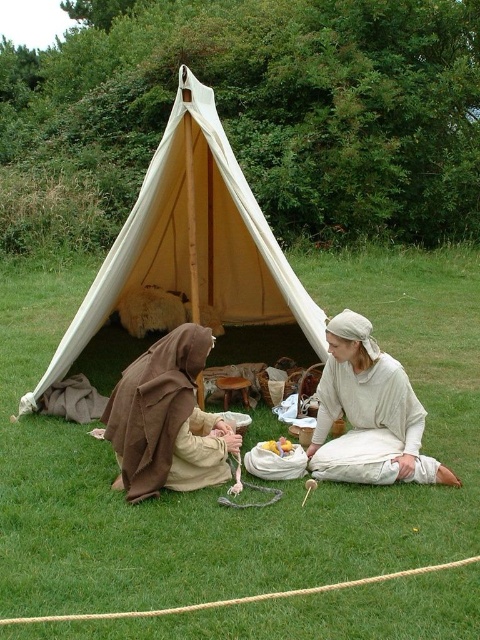
Question: Among these points, which one is nearest to the camera?

Choices:
 (A) (164, 374)
 (B) (215, 586)

Answer: (B)

Question: Estimate the real-world distances between objects in this image. Which object is farther from the light beige fabric at center?

Choices:
 (A) green grass at center
 (B) beige canvas tent at center

Answer: (B)

Question: Which point appears closest to the camera in this image?

Choices:
 (A) (273, 289)
 (B) (23, 566)
 (C) (191, 422)

Answer: (B)

Question: Does brown cloth at lower left have a greater width compared to light beige fabric at center?

Choices:
 (A) yes
 (B) no

Answer: (A)

Question: Does beige canvas tent at center appear under brown cloth at lower left?

Choices:
 (A) no
 (B) yes

Answer: (A)

Question: Can you confirm if green grass at center is positioned to the right of beige canvas tent at center?

Choices:
 (A) no
 (B) yes

Answer: (B)